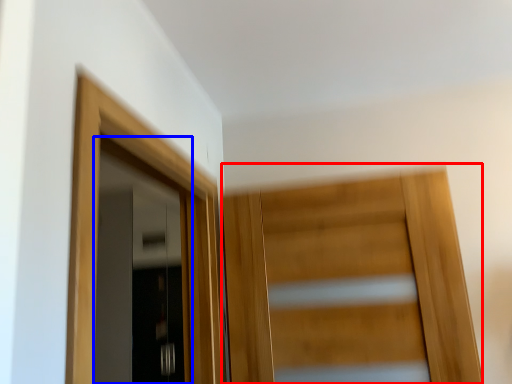
Question: Which point is closer to the camera, door (highlighted by a red box) or door (highlighted by a blue box)?

Choices:
 (A) door
 (B) door

Answer: (A)